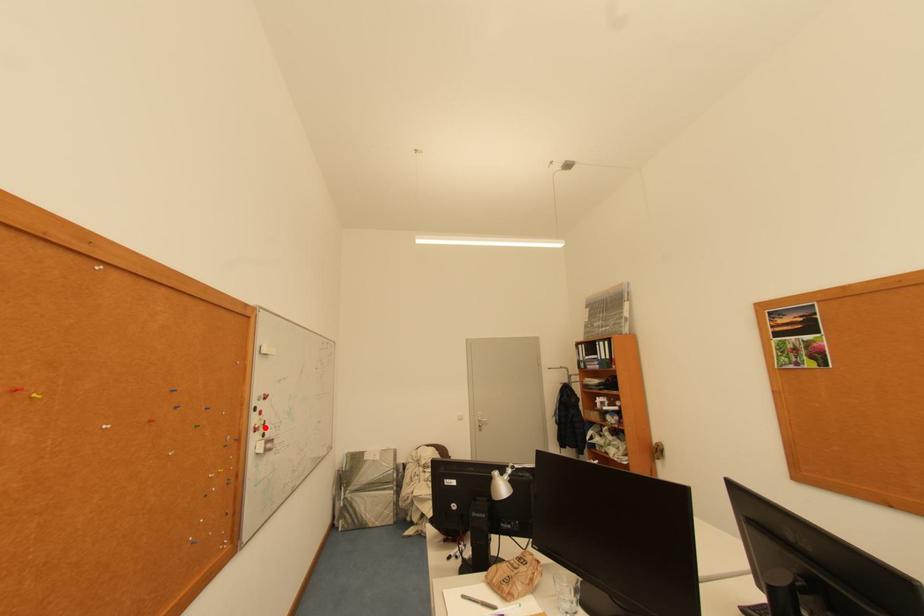
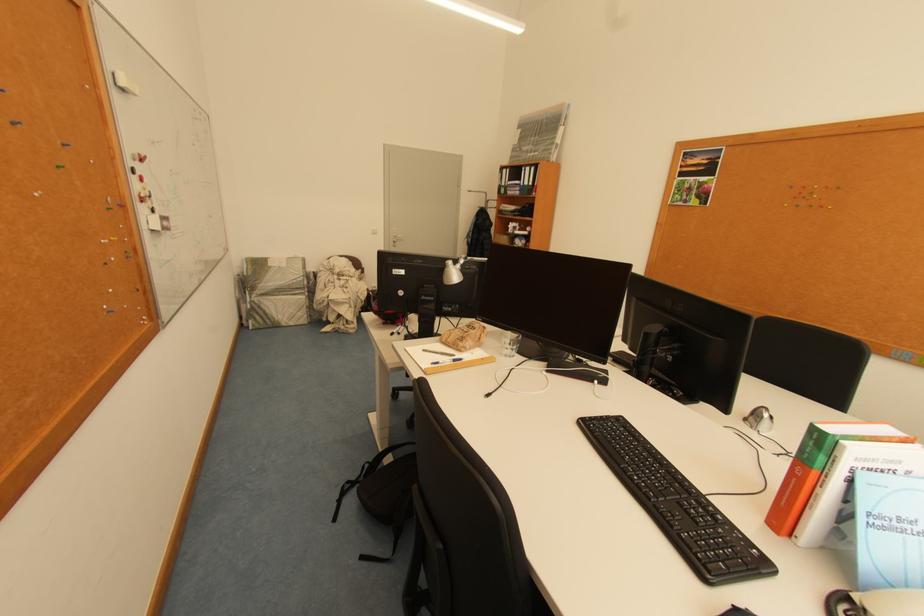
Find the pixel in the second image that matches the highlighted location in the first image.

(151, 197)